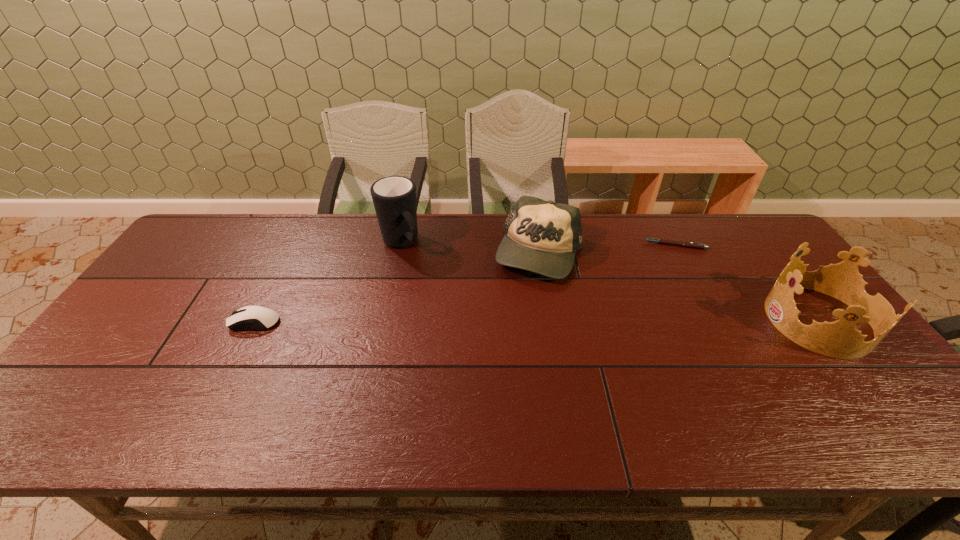
The width and height of the screenshot is (960, 540). Identify the location of vacant space that's between the fourth object from right to left and the second shortest object. (328, 282).

Locate an element on the screen. The height and width of the screenshot is (540, 960). empty location between the mug and the mouse is located at coordinates (328, 282).

You are a GUI agent. You are given a task and a screenshot of the screen. Output one action in this format:
    pyautogui.click(x=<x>, y=<y>)
    Task: Click on the free space that is in between the mug and the fourth tallest object
    The width and height of the screenshot is (960, 540).
    Given the screenshot: What is the action you would take?
    pyautogui.click(x=328, y=282)

Where is `blank region between the second object from left to right and the tiara`? This screenshot has height=540, width=960. blank region between the second object from left to right and the tiara is located at coordinates (610, 282).

Where is `empty space that is in between the third shortest object and the tiara`? empty space that is in between the third shortest object and the tiara is located at coordinates click(679, 287).

At what (x,y) coordinates should I click in order to perform the action: click on free space between the rightmost object and the second object from left to right. Please return your answer as a coordinate pair (x, y). Looking at the image, I should click on (610, 282).

This screenshot has width=960, height=540. Find the location of `free space between the baseball cap and the leftmost object`. free space between the baseball cap and the leftmost object is located at coordinates (397, 287).

Locate an element on the screen. vacant space that is in between the rightmost object and the baseball cap is located at coordinates [x=679, y=287].

Identify the location of the second closest object to the rightmost object. (541, 236).

At what (x,y) coordinates should I click in order to perform the action: click on object that ranks as the fourth closest to the leftmost object. Please return your answer as a coordinate pair (x, y). Looking at the image, I should click on (840, 339).